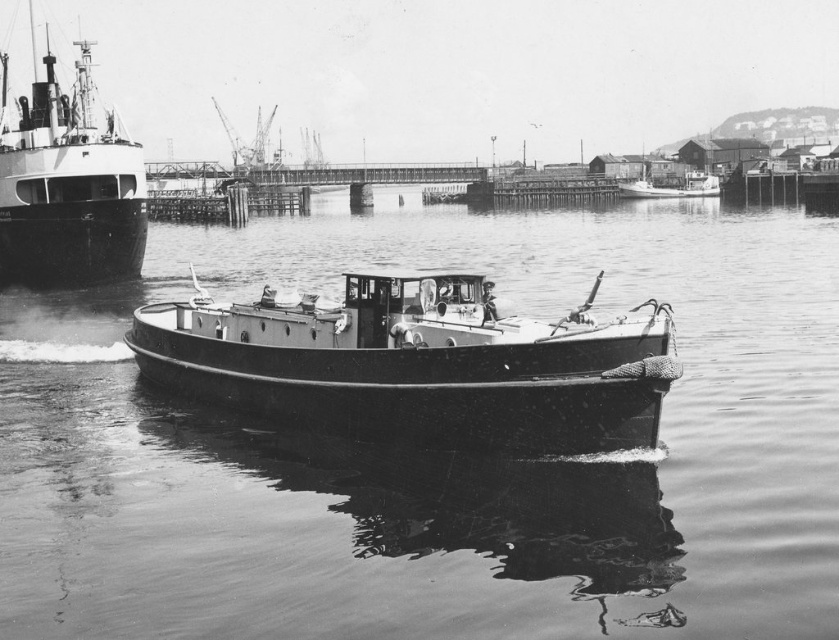
Question: Can you confirm if smooth water at center is bigger than shiny black ship at left?

Choices:
 (A) yes
 (B) no

Answer: (B)

Question: Which object is the farthest from the shiny black ship at left?

Choices:
 (A) smooth wooden boat at center
 (B) smooth water at center

Answer: (A)

Question: Is smooth water at center to the right of shiny black ship at left from the viewer's perspective?

Choices:
 (A) yes
 (B) no

Answer: (A)

Question: Which object is positioned farthest from the smooth water at center?

Choices:
 (A) smooth wooden boat at center
 (B) shiny black ship at left

Answer: (B)

Question: Is smooth water at center above shiny black ship at left?

Choices:
 (A) yes
 (B) no

Answer: (B)

Question: Considering the real-world distances, which object is closest to the smooth water at center?

Choices:
 (A) shiny black ship at left
 (B) smooth wooden boat at center

Answer: (B)